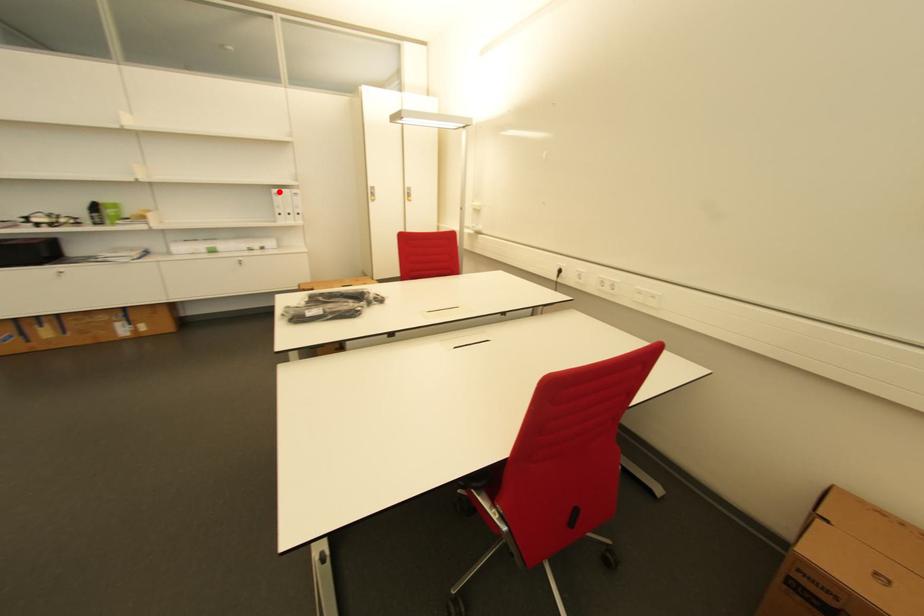
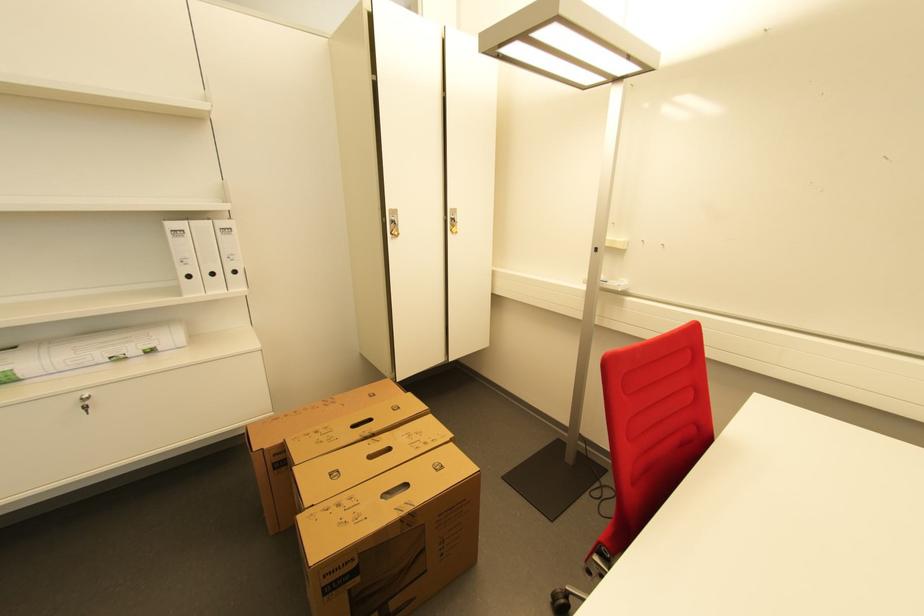
Question: I am providing you with two images of the same scene from different viewpoints. Image1 has a red point marked. In image2, the corresponding 3D location appears at what relative position? Reply with the corresponding letter.

Choices:
 (A) Closer
 (B) Farther

Answer: (B)